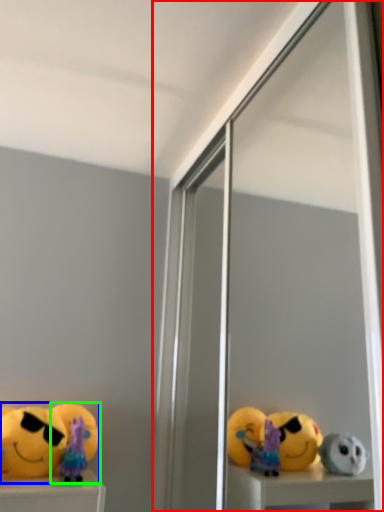
Question: Considering the real-world distances, which object is closest to screen door (highlighted by a red box)? toy (highlighted by a blue box) or toy (highlighted by a green box).

Choices:
 (A) toy
 (B) toy

Answer: (A)